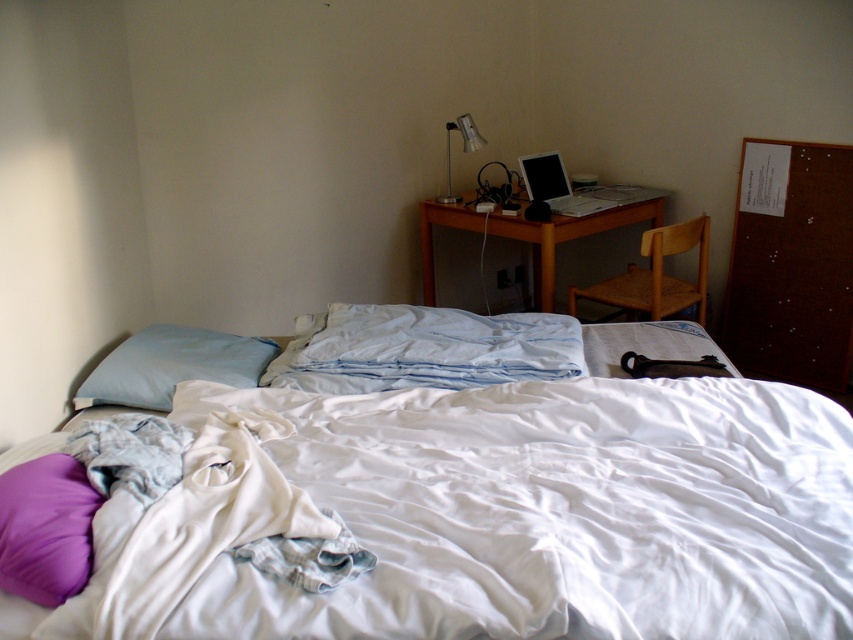
In the scene shown: You are standing at the entrance of the bedroom and want to move to the white cotton bed at center. Based on the coordinates provided, in which general direction should you walk from the entrance?

The white cotton bed at center is located at coordinates approximately 0.794 on the x axis and 0.654 on the y axis. Since the entrance is typically located opposite to the bed in many bedroom layouts, you should walk towards the center of the room where the coordinates indicate the bed is positioned.

You are organizing the bedroom and need to move the white cotton bed at center and the silver metallic laptop at upper right. Which object should you move first if you want to access the other one?

You should move the white cotton bed at center first because it is in front of the silver metallic laptop at upper right, so moving it will allow access to the laptop.

You are standing in the bedroom and want to reach both points. Which point, point (x=0, y=582) or point (x=463, y=148), is closer to you?

Point (x=0, y=582) is closer to the viewer than point (x=463, y=148).